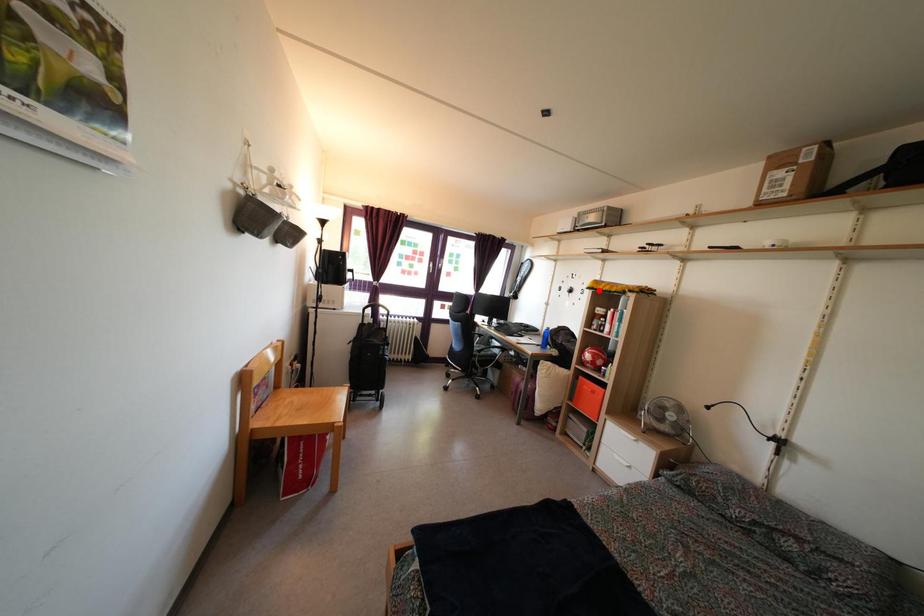
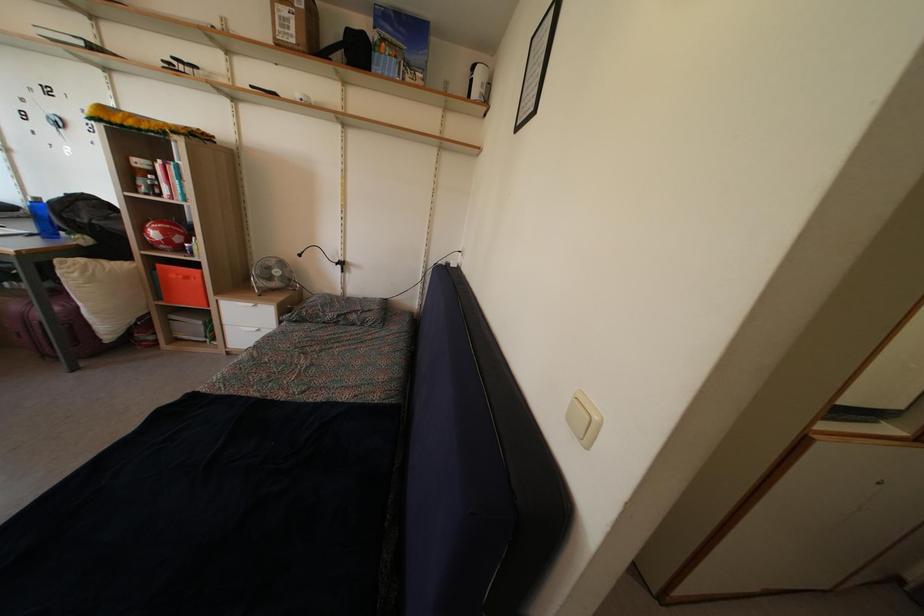
Question: I am providing you with two images of the same scene from different viewpoints. Given a red point in image1, look at the same physical point in image2. Is it:

Choices:
 (A) Closer to the viewpoint
 (B) Farther from the viewpoint

Answer: (B)